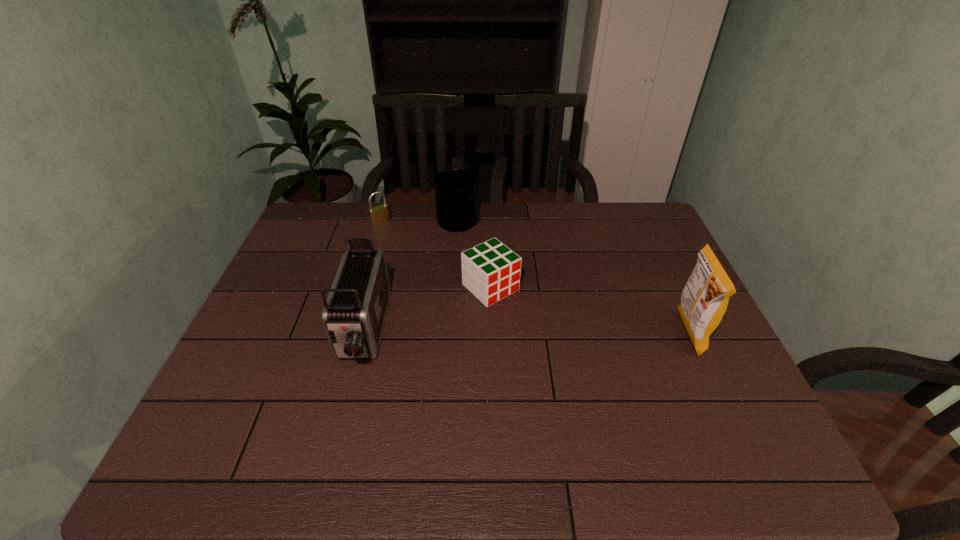
I want to click on free space located on the red face of the cube, so click(609, 393).

Where is `vacant region located on the red face of the cube`? The height and width of the screenshot is (540, 960). vacant region located on the red face of the cube is located at coordinates (574, 362).

Locate an element on the screen. The image size is (960, 540). free space located on the side of the third tallest object with the handle is located at coordinates (533, 298).

The image size is (960, 540). I want to click on blank area located on the side of the third tallest object with the handle, so click(x=494, y=262).

Find the location of `vacant space located 0.340m on the side of the third tallest object with the handle`. vacant space located 0.340m on the side of the third tallest object with the handle is located at coordinates (530, 296).

Where is `padlock present at the far edge`? This screenshot has width=960, height=540. padlock present at the far edge is located at coordinates (380, 214).

Image resolution: width=960 pixels, height=540 pixels. Find the location of `mug that is at the far edge`. mug that is at the far edge is located at coordinates (455, 189).

At what (x,y) coordinates should I click in order to perform the action: click on object that is at the right edge. Please return your answer as a coordinate pair (x, y). The width and height of the screenshot is (960, 540). Looking at the image, I should click on (704, 299).

Identify the location of vacant space at the far edge. The image size is (960, 540). (539, 220).

Where is `vacant region at the near edge of the desktop`? The height and width of the screenshot is (540, 960). vacant region at the near edge of the desktop is located at coordinates (331, 416).